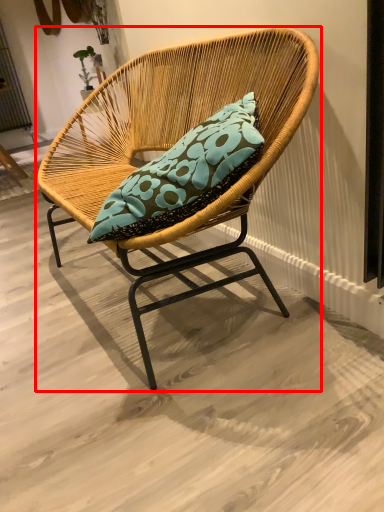
Question: From the image's perspective, where is chair (annotated by the red box) located in relation to screen door in the image?

Choices:
 (A) below
 (B) above

Answer: (A)